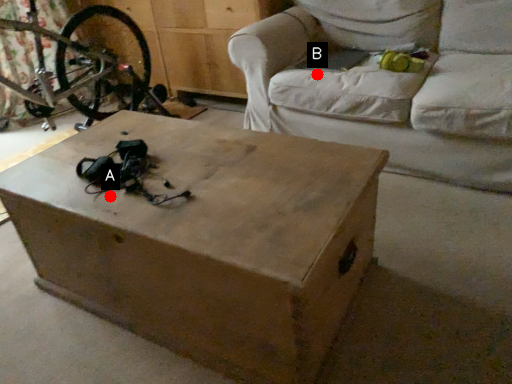
Question: Two points are circled on the image, labeled by A and B beside each circle. Among these points, which one is nearest to the camera?

Choices:
 (A) A is closer
 (B) B is closer

Answer: (A)